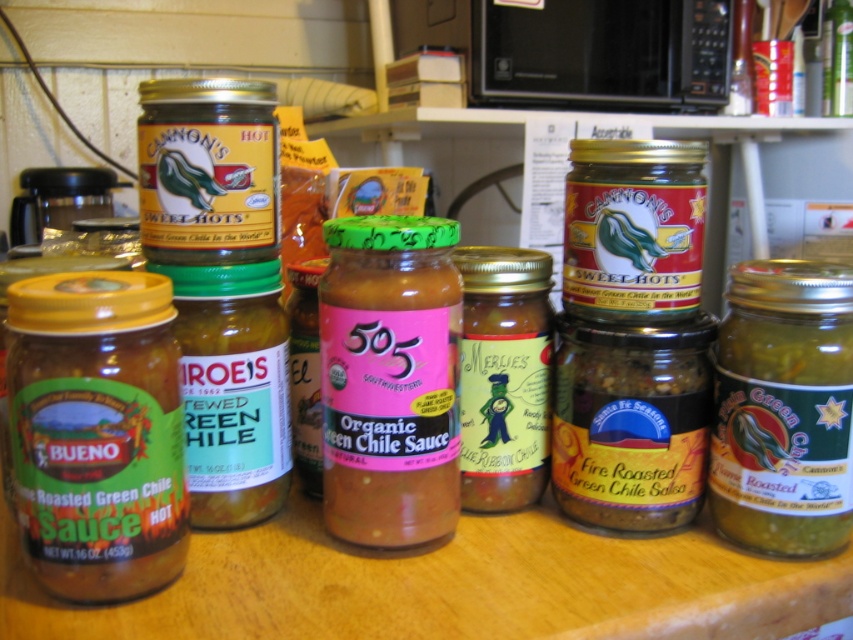
Please provide the coordinates of the green matte glass jar at center in the image. The coordinates should be in the format of a point with two decimal places, such as point 0.659, 0.741. The answer should be in the format of point followed by the coordinates. For example, point 0.659, 0.741.

point (631, 420)

In the scene shown: You are organizing condiments on a shelf and see the green matte glass jar at center and the green glass jar at center. Which one is positioned lower?

The green matte glass jar at center is positioned lower than the green glass jar at center according to the description.